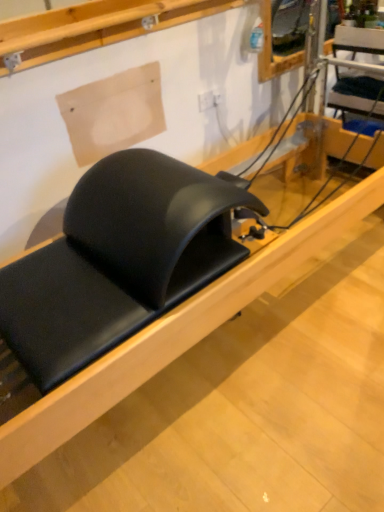
What are the coordinates of `vacant region above black leather bench at center (from a real-world perspective)` in the screenshot? It's located at (272, 355).